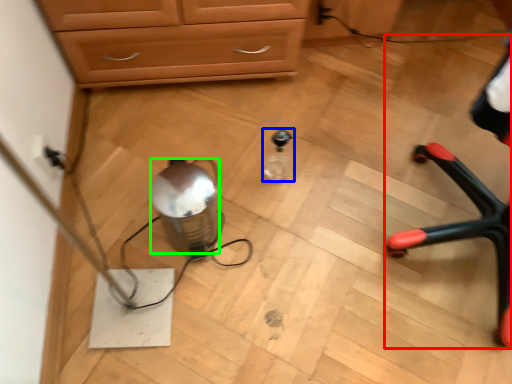
Question: Which object is the closest to the armchair (highlighted by a red box)? Choose among these: bottle (highlighted by a blue box) or water (highlighted by a green box).

Choices:
 (A) bottle
 (B) water

Answer: (A)